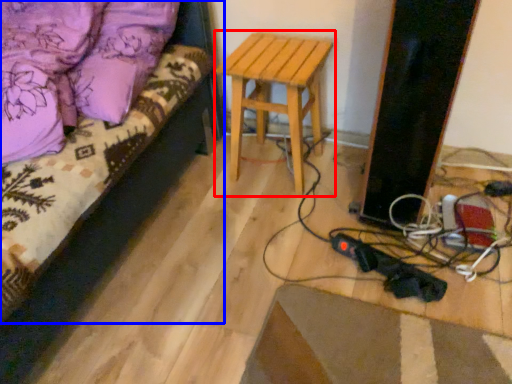
Question: Which of the following is the farthest to the observer, stool (highlighted by a red box) or furniture (highlighted by a blue box)?

Choices:
 (A) stool
 (B) furniture

Answer: (A)